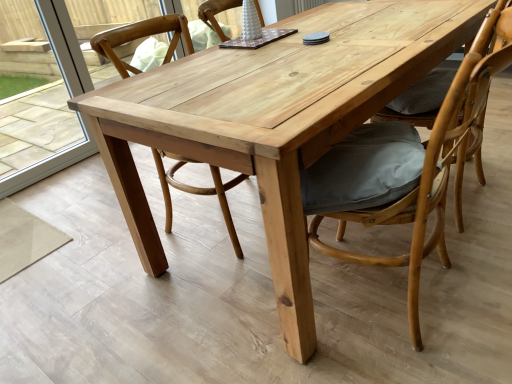
Question: Based on their sizes in the image, would you say matte gray cushion at right, the 3th chair viewed from the left, is bigger or smaller than wooden cushioned chair at center, arranged as the 2th chair when viewed from the left?

Choices:
 (A) small
 (B) big

Answer: (A)

Question: Relative to wooden cushioned chair at center, arranged as the 2th chair when viewed from the left, is matte gray cushion at right, arranged as the 1th chair when viewed from the right, in front or behind?

Choices:
 (A) behind
 (B) front

Answer: (A)

Question: Estimate the real-world distances between objects in this image. Which object is farther from the natural wood chair at center, the 3th chair from the right?

Choices:
 (A) wooden cushioned chair at center, which is the second chair in right-to-left order
 (B) transparent glass door at left
 (C) matte gray cushion at right, arranged as the 1th chair when viewed from the right

Answer: (C)

Question: Estimate the real-world distances between objects in this image. Which object is farther from the matte gray cushion at right, the 3th chair viewed from the left?

Choices:
 (A) transparent glass door at left
 (B) wooden cushioned chair at center, arranged as the 2th chair when viewed from the left
 (C) natural wood chair at center, which is counted as the 1th chair, starting from the left

Answer: (A)